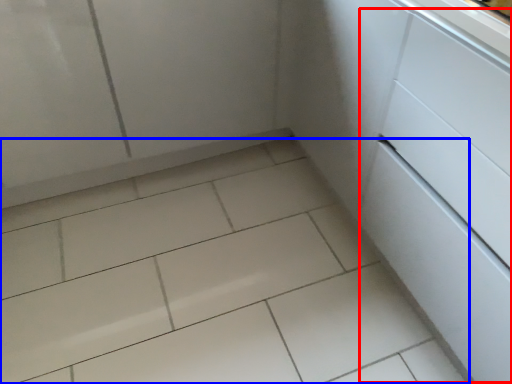
Question: Which of the following is the farthest to the observer, drawer (highlighted by a red box) or ceramic tile (highlighted by a blue box)?

Choices:
 (A) drawer
 (B) ceramic tile

Answer: (B)